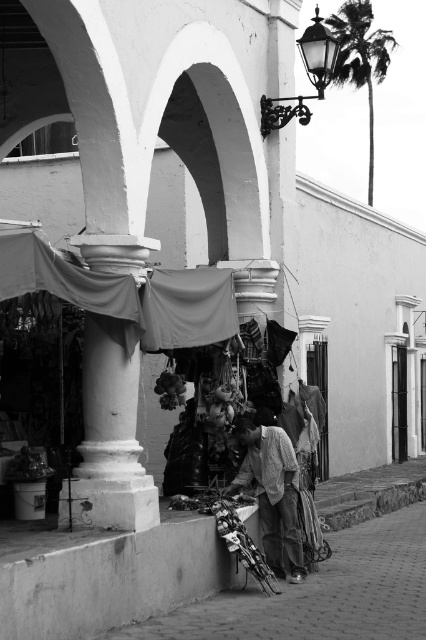
In the scene shown: You are a delivery person trying to place a small box on the smooth concrete pavement at lower center. However, there is a light gray fabric at center in the way. Can you move the fabric to make space for the box?

The smooth concrete pavement at lower center is wider than the light gray fabric at center, so you can move the light gray fabric at center aside to create enough space for the box on the smooth concrete pavement at lower center.

You are a tourist standing on the smooth concrete pavement at lower center and want to pick up the light gray fabric at center. Which direction should you move to reach it?

The smooth concrete pavement at lower center is to the right of light gray fabric at center, so you should move to your left to reach it.

You are standing on the smooth concrete pavement at lower center and looking towards the light gray fabric at center. Which object is nearer to you?

The smooth concrete pavement at lower center is closer to you than the light gray fabric at center.